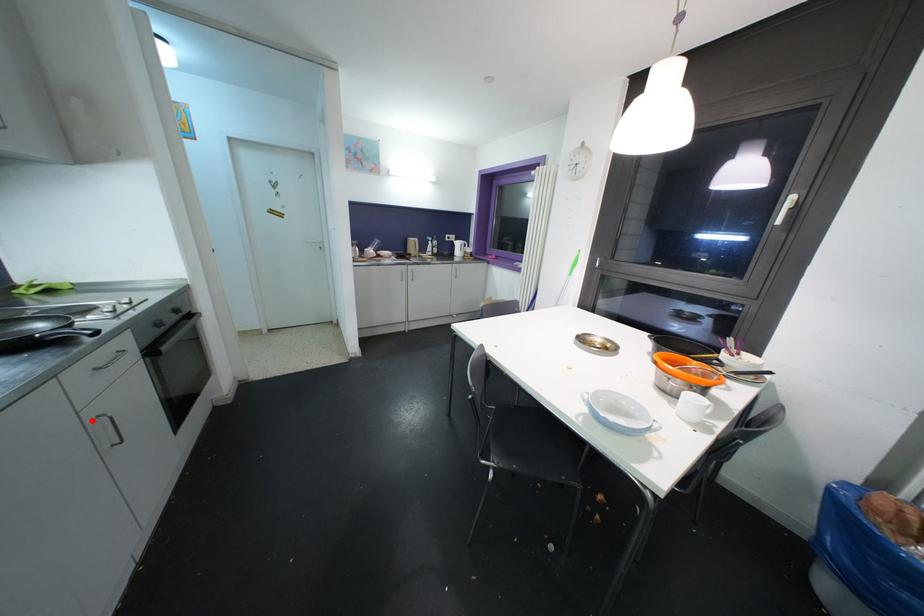
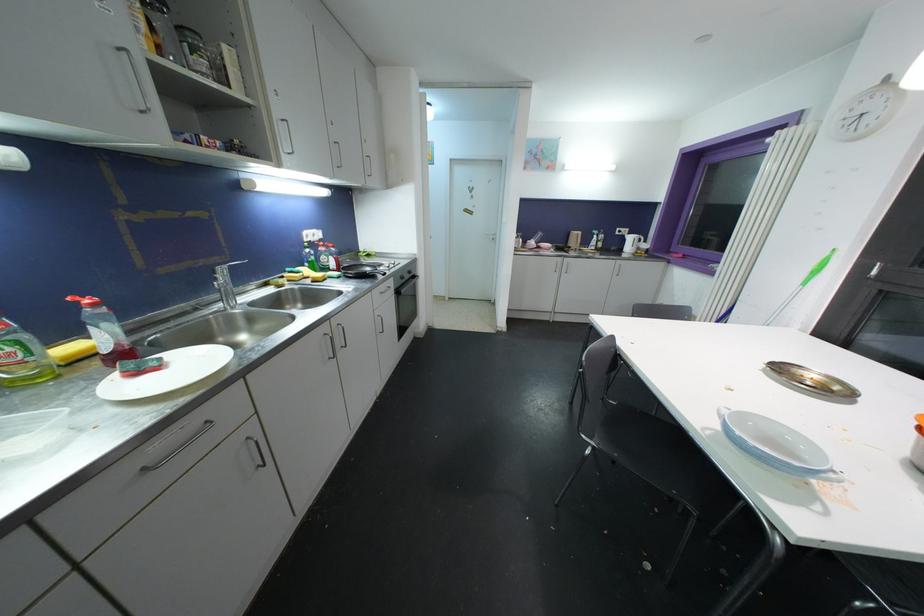
Locate, in the second image, the point that corresponds to the highlighted location in the first image.

(379, 318)